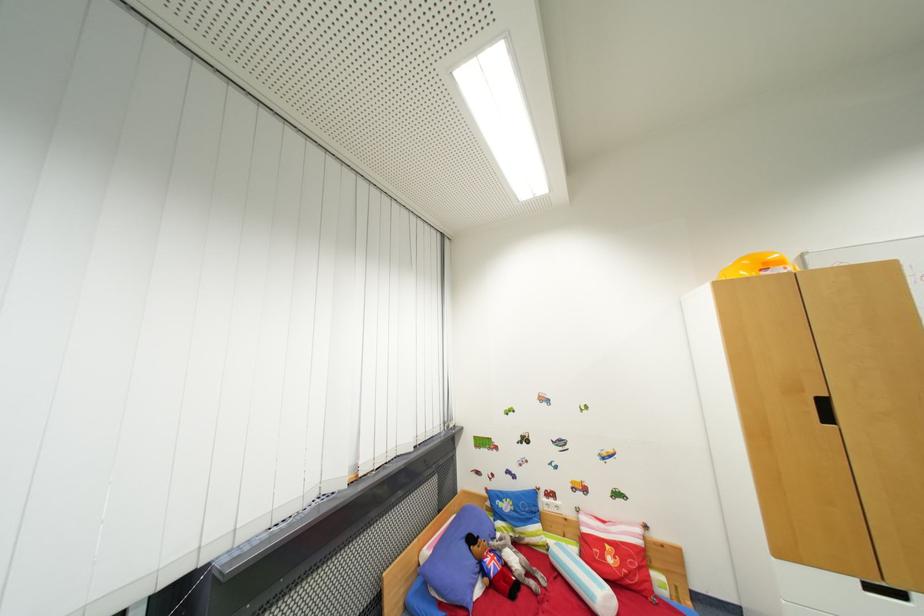
This screenshot has height=616, width=924. In order to click on red and white pillow in this screenshot , I will do `click(615, 553)`.